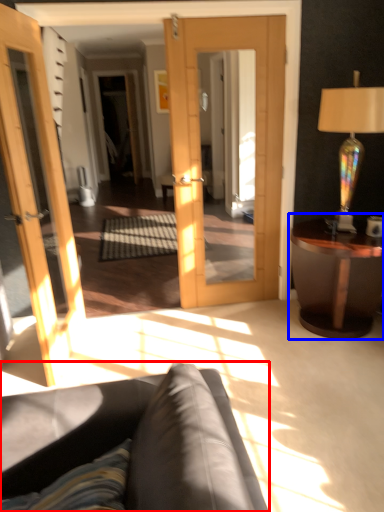
Question: Which point is further to the camera, studio couch (highlighted by a red box) or table (highlighted by a blue box)?

Choices:
 (A) studio couch
 (B) table

Answer: (B)